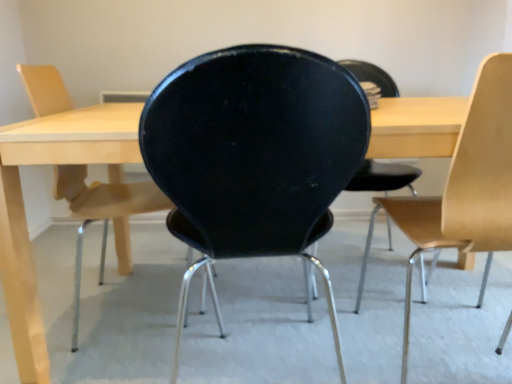
Question: Can you confirm if matte black chair at center, marked as the third chair in a right-to-left arrangement, is taller than light wood/wooden chair at right, the first chair from the right?

Choices:
 (A) no
 (B) yes

Answer: (A)

Question: Is light wood/wooden chair at right, the 3th chair from the left, inside matte black chair at center, marked as the third chair in a right-to-left arrangement?

Choices:
 (A) yes
 (B) no

Answer: (B)

Question: Is matte black chair at center, marked as the third chair in a right-to-left arrangement, looking in the opposite direction of light wood/wooden chair at right, the 3th chair from the left?

Choices:
 (A) no
 (B) yes

Answer: (A)

Question: Does matte black chair at center, which appears as the 1th chair when viewed from the left, have a lesser width compared to light wood/wooden chair at right, the 3th chair from the left?

Choices:
 (A) yes
 (B) no

Answer: (A)

Question: From the image's perspective, does matte black chair at center, marked as the third chair in a right-to-left arrangement, appear lower than light wood/wooden chair at right, the first chair from the right?

Choices:
 (A) yes
 (B) no

Answer: (B)

Question: In terms of width, does light wood/wooden chair at right, the first chair from the right, look wider or thinner when compared to black matte chair at center, the second chair in the right-to-left sequence?

Choices:
 (A) wide
 (B) thin

Answer: (A)

Question: Is point (453, 168) positioned closer to the camera than point (193, 150)?

Choices:
 (A) closer
 (B) farther

Answer: (B)

Question: From the image's perspective, is light wood/wooden chair at right, the 3th chair from the left, positioned above or below black matte chair at center, the second chair in the right-to-left sequence?

Choices:
 (A) below
 (B) above

Answer: (B)

Question: Is light wood/wooden chair at right, the first chair from the right, to the left or to the right of black matte chair at center, the second chair in the right-to-left sequence, in the image?

Choices:
 (A) left
 (B) right

Answer: (B)

Question: Considering the positions of matte black chair at center, marked as the third chair in a right-to-left arrangement, and light wood/wooden chair at right, the first chair from the right, in the image, is matte black chair at center, marked as the third chair in a right-to-left arrangement, wider or thinner than light wood/wooden chair at right, the first chair from the right,?

Choices:
 (A) thin
 (B) wide

Answer: (A)

Question: From a real-world perspective, is matte black chair at center, marked as the third chair in a right-to-left arrangement, physically located above or below light wood/wooden chair at right, the 3th chair from the left?

Choices:
 (A) below
 (B) above

Answer: (A)

Question: Relative to light wood/wooden chair at right, the first chair from the right, is matte black chair at center, which appears as the 1th chair when viewed from the left, in front or behind?

Choices:
 (A) behind
 (B) front

Answer: (A)

Question: From the image's perspective, is matte black chair at center, which appears as the 1th chair when viewed from the left, above or below light wood/wooden chair at right, the 3th chair from the left?

Choices:
 (A) above
 (B) below

Answer: (A)

Question: Considering the positions of black matte chair at center, which ranks as the second chair in left-to-right order, and light wood/wooden chair at right, the 3th chair from the left, in the image, is black matte chair at center, which ranks as the second chair in left-to-right order, taller or shorter than light wood/wooden chair at right, the 3th chair from the left,?

Choices:
 (A) short
 (B) tall

Answer: (A)

Question: Is black matte chair at center, the second chair in the right-to-left sequence, in front of or behind light wood/wooden chair at right, the first chair from the right, in the image?

Choices:
 (A) behind
 (B) front

Answer: (B)